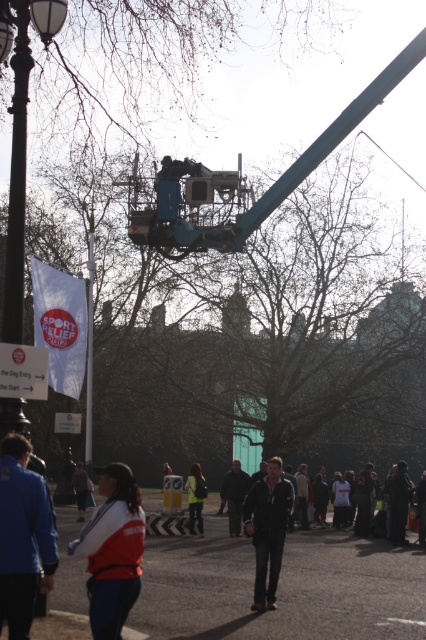
Question: Considering the real-world distances, which object is closest to the red fabric vest at lower center?

Choices:
 (A) dark blue jacket at center
 (B) blue fabric jacket at lower left

Answer: (B)

Question: Is blue fabric jacket at lower left smaller than white plastic banner at left?

Choices:
 (A) no
 (B) yes

Answer: (B)

Question: Based on their relative distances, which object is nearer to the red fabric vest at lower center?

Choices:
 (A) dark blue jacket at center
 (B) black metal lamp post at left
 (C) blue fabric jacket at lower left

Answer: (C)

Question: Which is nearer to the dark gray fabric jacket at center?

Choices:
 (A) red fabric vest at lower center
 (B) reflective yellow vest at center
 (C) blue fabric jacket at lower left
 (D) dark blue jacket at center

Answer: (B)

Question: In this image, where is dark blue jacket at center located relative to white plastic banner at left?

Choices:
 (A) below
 (B) above

Answer: (A)

Question: Does black metal lamp post at left appear on the left side of reflective yellow vest at center?

Choices:
 (A) yes
 (B) no

Answer: (A)